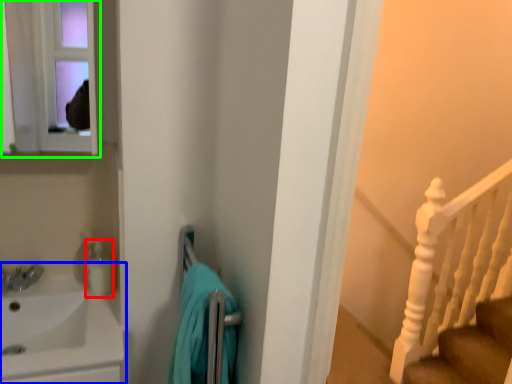
Question: Which is farther away from toiletry (highlighted by a red box)? sink (highlighted by a blue box) or medicine cabinet (highlighted by a green box)?

Choices:
 (A) sink
 (B) medicine cabinet

Answer: (B)